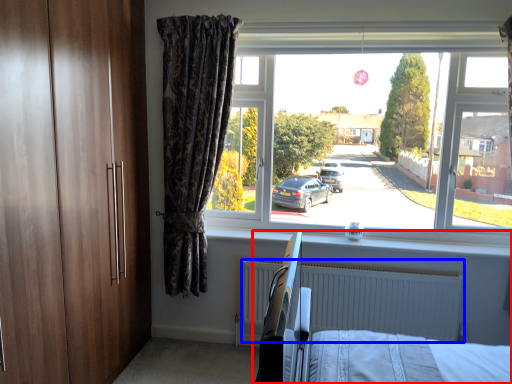
Question: Which object is further to the camera taking this photo, hospital bed (highlighted by a red box) or radiator (highlighted by a blue box)?

Choices:
 (A) hospital bed
 (B) radiator

Answer: (B)